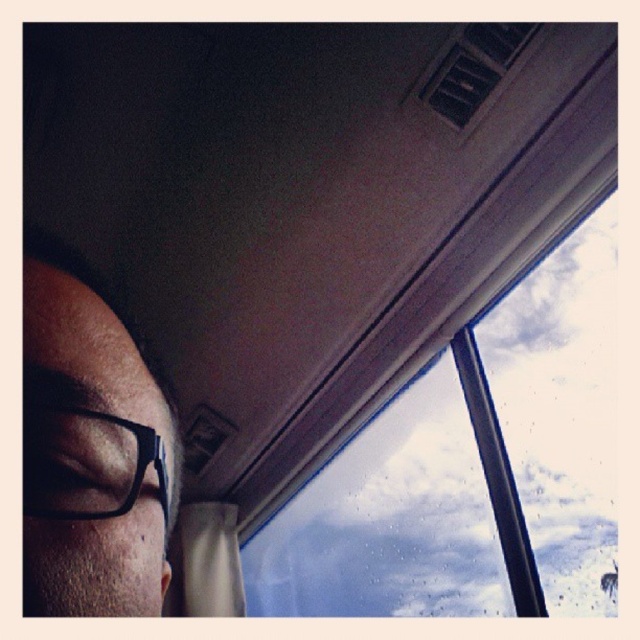
You are sitting inside a vehicle and looking at the transparent glass window at upper right and the black plastic glasses at lower left. Which object is taller?

The transparent glass window at upper right is taller than the black plastic glasses at lower left.

You are a passenger on a train and notice two pairs of glasses in your view. The matte black glasses at left and the black plastic glasses at lower left. Which pair is closer to you?

The matte black glasses at left is closer to you because it is in front of the black plastic glasses at lower left.